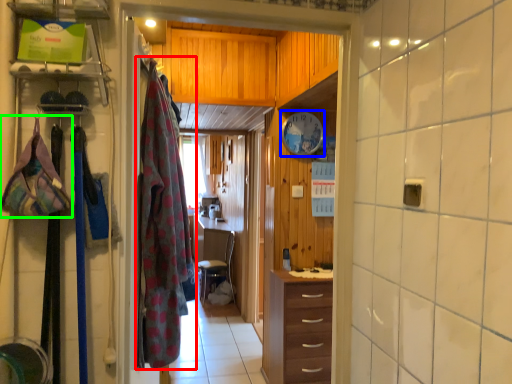
Question: Which object is positioned closest to clothing (highlighted by a red box)? Select from clock (highlighted by a blue box) and clothing (highlighted by a green box).

Choices:
 (A) clock
 (B) clothing

Answer: (B)